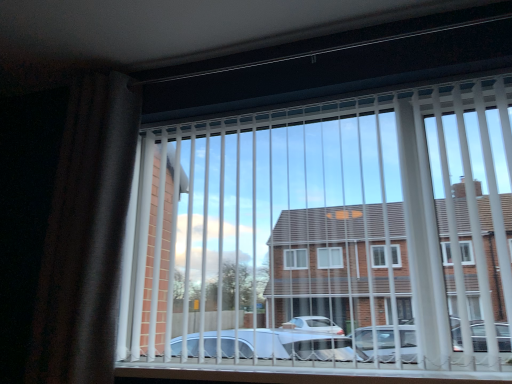
Identify the location of white plastic blinds at center. (327, 235).

The image size is (512, 384). What do you see at coordinates (327, 235) in the screenshot?
I see `white plastic blinds at center` at bounding box center [327, 235].

In order to face dark fabric curtain at left, should I rotate leftwards or rightwards?

You should rotate left by 22.168 degrees.

This screenshot has height=384, width=512. What do you see at coordinates (86, 235) in the screenshot?
I see `dark fabric curtain at left` at bounding box center [86, 235].

Where is `dark fabric curtain at left`? dark fabric curtain at left is located at coordinates (86, 235).

Where is `white plastic blinds at center`? white plastic blinds at center is located at coordinates (327, 235).

Which object is positioned more to the left, dark fabric curtain at left or white plastic blinds at center?

Positioned to the left is dark fabric curtain at left.

Considering their positions, is dark fabric curtain at left located in front of or behind white plastic blinds at center?

dark fabric curtain at left is positioned farther from the viewer than white plastic blinds at center.

Considering the positions of point (93, 220) and point (164, 131), is point (93, 220) closer or farther from the camera than point (164, 131)?

Point (93, 220) appears to be closer to the viewer than point (164, 131).

From the image's perspective, is dark fabric curtain at left located above or below white plastic blinds at center?

Based on their image positions, dark fabric curtain at left is located above white plastic blinds at center.

From a real-world perspective, is dark fabric curtain at left above or below white plastic blinds at center?

In terms of real-world spatial position, dark fabric curtain at left is above white plastic blinds at center.

Between dark fabric curtain at left and white plastic blinds at center, which one has smaller width?

white plastic blinds at center.

From their relative heights in the image, would you say dark fabric curtain at left is taller or shorter than white plastic blinds at center?

In the image, dark fabric curtain at left appears to be taller than white plastic blinds at center.

Based on the photo, based on their sizes in the image, would you say dark fabric curtain at left is bigger or smaller than white plastic blinds at center?

dark fabric curtain at left is smaller than white plastic blinds at center.

Is dark fabric curtain at left completely or partially outside of white plastic blinds at center?

dark fabric curtain at left lies outside white plastic blinds at center's area.

Does dark fabric curtain at left touch white plastic blinds at center?

No, dark fabric curtain at left is not next to white plastic blinds at center.

Could you tell me if dark fabric curtain at left is facing white plastic blinds at center?

No.

The height and width of the screenshot is (384, 512). I want to click on curtain behind the white plastic blinds at center, so click(86, 235).

Between white plastic blinds at center and dark fabric curtain at left, which one appears on the right side from the viewer's perspective?

From the viewer's perspective, white plastic blinds at center appears more on the right side.

In the image, is white plastic blinds at center positioned in front of or behind dark fabric curtain at left?

white plastic blinds at center is positioned closer to the viewer than dark fabric curtain at left.

Which is further, (407, 345) or (90, 206)?

The point (90, 206) is farther.

From the image's perspective, is white plastic blinds at center located above dark fabric curtain at left?

Actually, white plastic blinds at center appears below dark fabric curtain at left in the image.

From a real-world perspective, is white plastic blinds at center on top of dark fabric curtain at left?

A: No, from a real-world perspective, white plastic blinds at center is not over dark fabric curtain at left

Considering the relative sizes of white plastic blinds at center and dark fabric curtain at left in the image provided, is white plastic blinds at center wider than dark fabric curtain at left?

No.

Can you confirm if white plastic blinds at center is shorter than dark fabric curtain at left?

Indeed, white plastic blinds at center has a lesser height compared to dark fabric curtain at left.

Between white plastic blinds at center and dark fabric curtain at left, which one has smaller size?

dark fabric curtain at left.

Is dark fabric curtain at left inside white plastic blinds at center?

No, dark fabric curtain at left is located outside of white plastic blinds at center.

Is white plastic blinds at center touching dark fabric curtain at left?

No.

Is white plastic blinds at center aimed at dark fabric curtain at left?

No, white plastic blinds at center is not facing towards dark fabric curtain at left.

How different are the orientations of white plastic blinds at center and dark fabric curtain at left in degrees?

They differ by 0.0018 degrees in their facing directions.

At what (x,y) coordinates should I click in order to perform the action: click on curtain above the white plastic blinds at center (from the image's perspective). Please return your answer as a coordinate pair (x, y). This screenshot has height=384, width=512. Looking at the image, I should click on (86, 235).

Locate an element on the screen. window located underneath the dark fabric curtain at left (from a real-world perspective) is located at coordinates (327, 235).

Identify the location of curtain on the left of white plastic blinds at center. (86, 235).